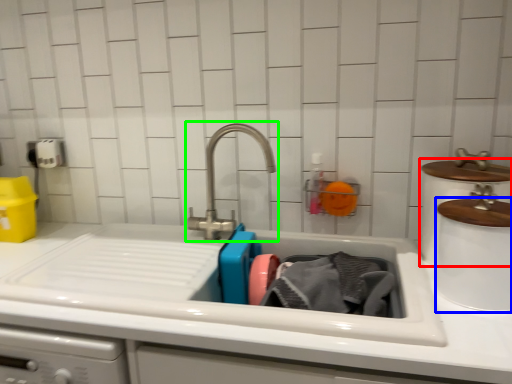
Question: Which is farther away from appliance (highlighted by a red box)? appliance (highlighted by a blue box) or tap (highlighted by a green box)?

Choices:
 (A) appliance
 (B) tap

Answer: (B)